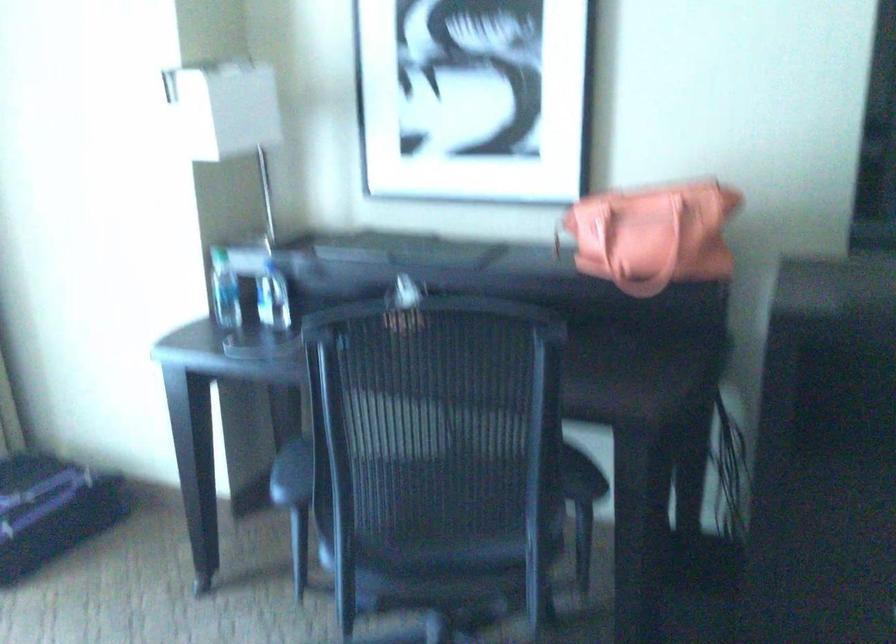
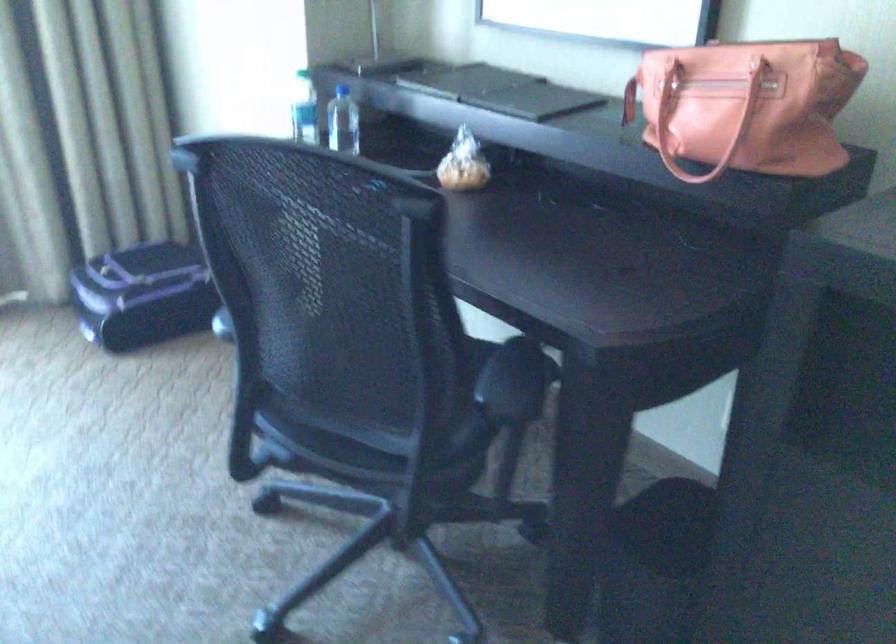
Where in the second image is the point corresponding to point (641, 242) from the first image?

(704, 122)